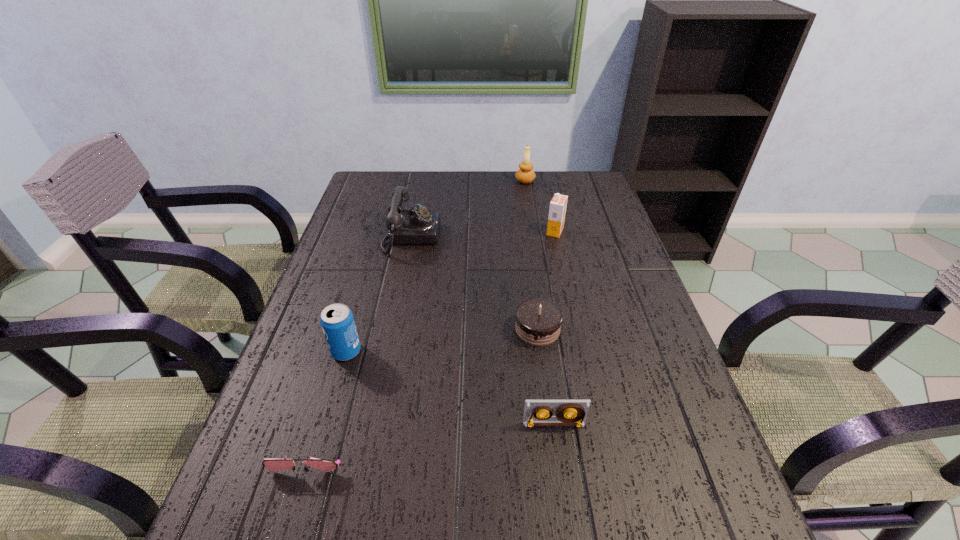
I want to click on free space between the second nearest object and the chocolate cake, so click(x=546, y=377).

Locate an element on the screen. The image size is (960, 540). unoccupied position between the chocolate cake and the candle_holder is located at coordinates (531, 255).

I want to click on vacant area that lies between the orange juice and the telephone, so 483,234.

This screenshot has height=540, width=960. What are the coordinates of `vacant region between the telephone and the soda can` in the screenshot? It's located at (379, 294).

Image resolution: width=960 pixels, height=540 pixels. Find the location of `free spot between the chocolate cake and the videotape`. free spot between the chocolate cake and the videotape is located at coordinates (546, 377).

This screenshot has width=960, height=540. What are the coordinates of `object that is the third nearest to the orange juice` in the screenshot? It's located at (417, 226).

Find the location of a particular element. object that can be found as the fifth closest to the chocolate cake is located at coordinates (324, 465).

I want to click on free spot that satisfies the following two spatial constraints: 1. on the dial of the chocolate cake; 2. on the left side of the telephone, so tap(393, 329).

Image resolution: width=960 pixels, height=540 pixels. Find the location of `free point that satisfies the following two spatial constraints: 1. on the dial of the telephone; 2. on the front side of the soda can`. free point that satisfies the following two spatial constraints: 1. on the dial of the telephone; 2. on the front side of the soda can is located at coordinates (389, 352).

Locate an element on the screen. This screenshot has width=960, height=540. vacant space that satisfies the following two spatial constraints: 1. on the dial of the chocolate cake; 2. on the left side of the telephone is located at coordinates (393, 329).